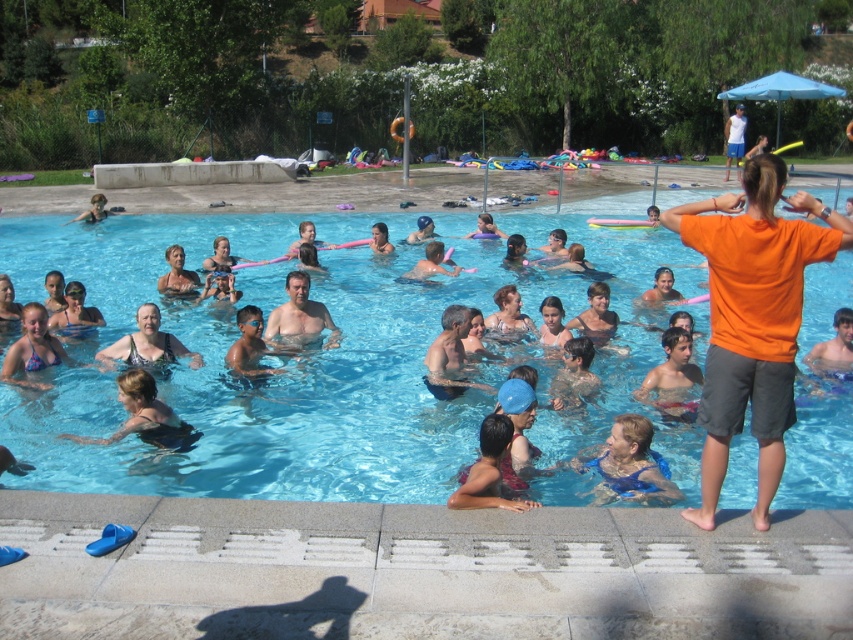
Question: Which object appears farthest from the camera in this image?

Choices:
 (A) matte black swimsuit at center
 (B) smooth skin man at center
 (C) transparent blue water at center
 (D) orange cotton shirt at right

Answer: (B)

Question: Which point appears closest to the camera in this image?

Choices:
 (A) (346, 340)
 (B) (268, 332)

Answer: (B)

Question: Is transparent blue water at center closer to camera compared to orange cotton shirt at right?

Choices:
 (A) no
 (B) yes

Answer: (A)

Question: Does transparent blue water at center have a lesser width compared to orange cotton shirt at right?

Choices:
 (A) yes
 (B) no

Answer: (B)

Question: From the image, what is the correct spatial relationship of transparent blue water at center in relation to orange cotton shirt at right?

Choices:
 (A) left
 (B) right

Answer: (A)

Question: Which object is positioned farthest from the orange cotton shirt at right?

Choices:
 (A) matte black swimsuit at center
 (B) smooth skin man at center
 (C) transparent blue water at center

Answer: (C)